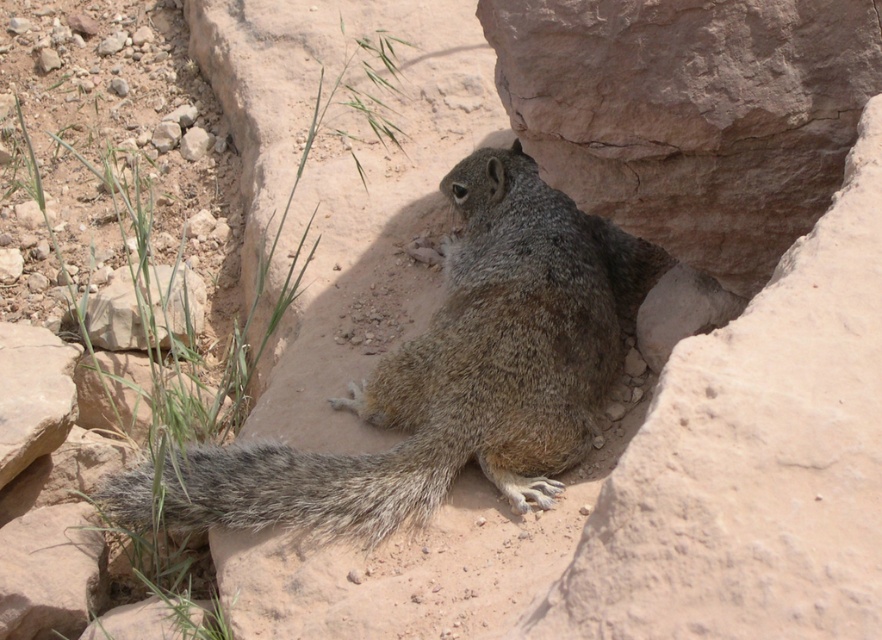
How much distance is there between gray-furred squirrel at center and gray rock at lower left?

29.84 inches

Can you confirm if gray-furred squirrel at center is taller than gray rock at lower left?

Correct, gray-furred squirrel at center is much taller as gray rock at lower left.

Who is more distant from viewer, (527,221) or (155,284)?

The point (155,284) is more distant.

At what (x,y) coordinates should I click in order to perform the action: click on gray-furred squirrel at center. Please return your answer as a coordinate pair (x, y). The width and height of the screenshot is (882, 640). Looking at the image, I should click on (458, 372).

Which is above, gray fuzzy tail at center or gray rock at lower left?

gray rock at lower left is higher up.

Does gray fuzzy tail at center appear on the right side of gray rock at lower left?

Correct, you'll find gray fuzzy tail at center to the right of gray rock at lower left.

Where is `gray fuzzy tail at center`? The image size is (882, 640). gray fuzzy tail at center is located at coordinates point(315,484).

You are a GUI agent. You are given a task and a screenshot of the screen. Output one action in this format:
    pyautogui.click(x=<x>, y=<y>)
    Task: Click on the gray fuzzy tail at center
    
    Given the screenshot: What is the action you would take?
    pyautogui.click(x=315, y=484)

Measure the distance between gray-furred squirrel at center and gray fuzzy tail at center.

They are 6.03 inches apart.

Does point (522, 381) come in front of point (105, 481)?

Yes, point (522, 381) is closer to viewer.

Who is more distant from viewer, [615,240] or [397,493]?

The point [615,240] is more distant.

This screenshot has width=882, height=640. Find the location of `gray-furred squirrel at center`. gray-furred squirrel at center is located at coordinates (458, 372).